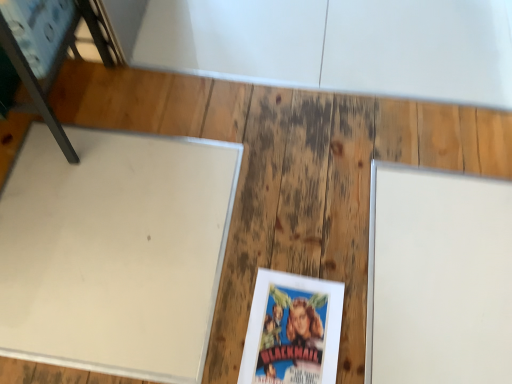
Identify the location of vacant space to the left of matte paper book at center. This screenshot has height=384, width=512. (194, 316).